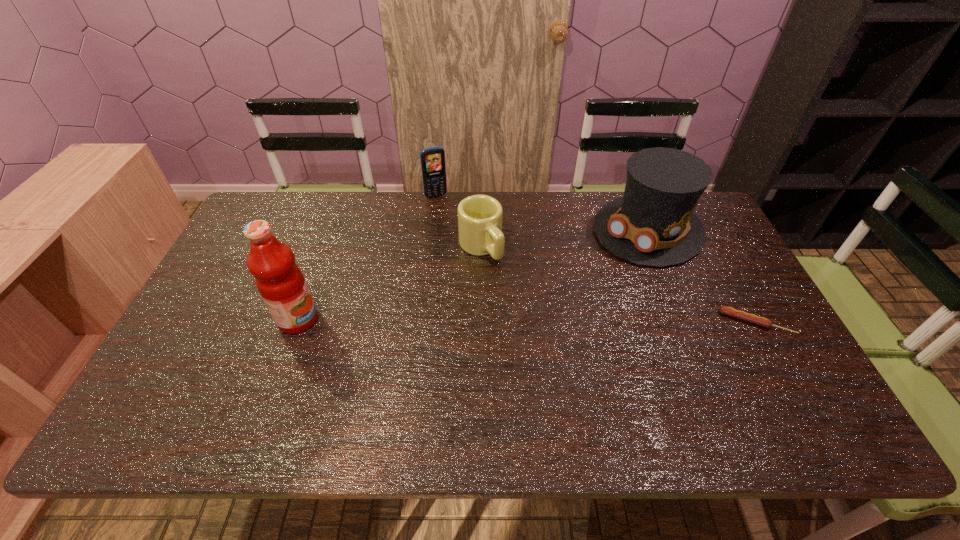
Identify the location of fruit juice. The height and width of the screenshot is (540, 960). (279, 280).

At what (x,y) coordinates should I click in order to perform the action: click on the leftmost object. Please return your answer as a coordinate pair (x, y). Looking at the image, I should click on (279, 280).

Locate an element on the screen. The height and width of the screenshot is (540, 960). the shortest object is located at coordinates (729, 311).

Locate an element on the screen. dress hat is located at coordinates (653, 224).

Image resolution: width=960 pixels, height=540 pixels. In order to click on mug in this screenshot , I will do `click(480, 233)`.

Where is `the third object from right to left`? the third object from right to left is located at coordinates (480, 233).

The image size is (960, 540). In order to click on cellular telephone in this screenshot , I will do [432, 159].

Identify the location of the second object from left to right. (432, 159).

Find the location of a particular element. vacant space situated 0.050m on the front label of the leftmost object is located at coordinates (337, 320).

Locate an element on the screen. vacant space located on the front of the sausage is located at coordinates (794, 392).